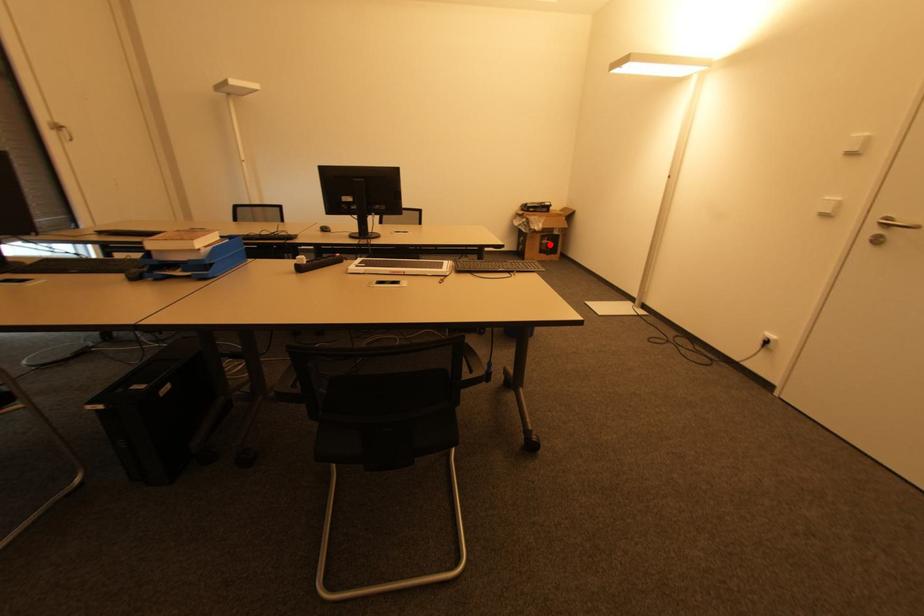
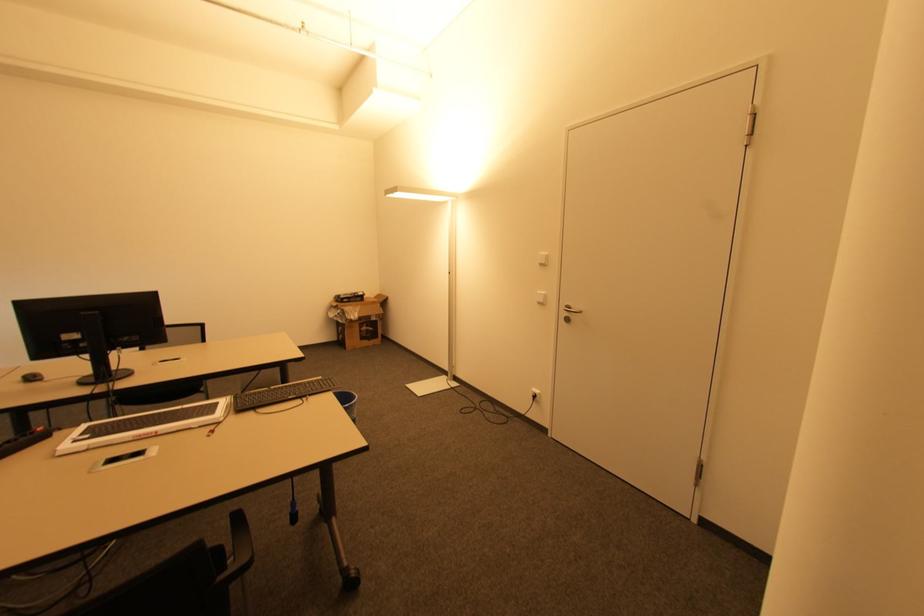
Question: I am providing you with two images of the same scene from different viewpoints. Given a red point in image1, look at the same physical point in image2. Is it:

Choices:
 (A) Closer to the viewpoint
 (B) Farther from the viewpoint

Answer: (B)